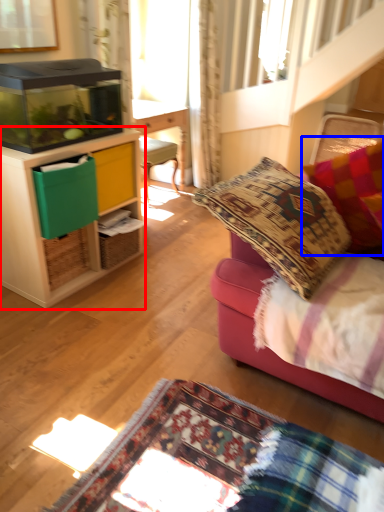
Question: Which object is closer to the camera taking this photo, cabinetry (highlighted by a red box) or pillow (highlighted by a blue box)?

Choices:
 (A) cabinetry
 (B) pillow

Answer: (B)